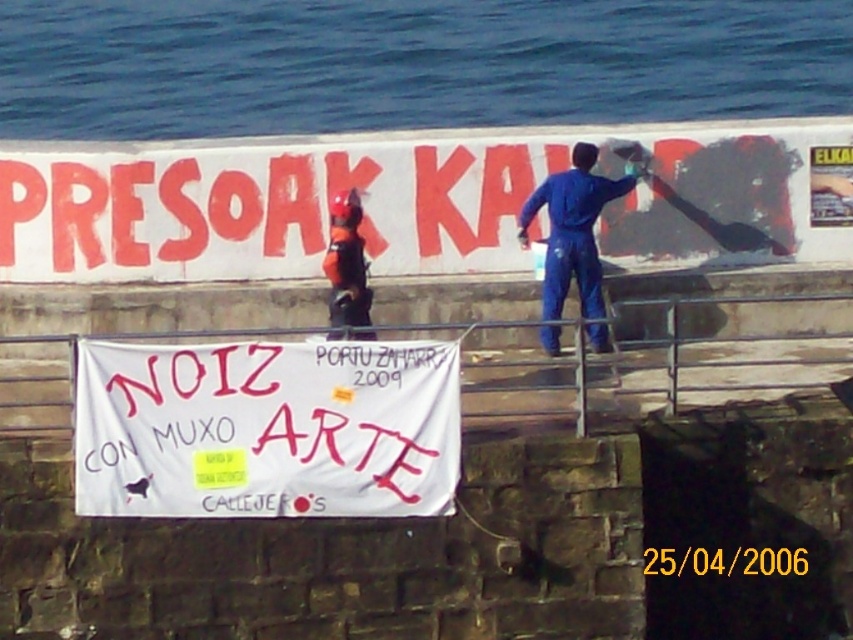
Question: Which of the following is the farthest from the observer?

Choices:
 (A) (65, 353)
 (B) (585, 300)
 (C) (421, 394)
 (D) (329, 289)

Answer: (A)

Question: Based on their relative distances, which object is nearer to the blue water at upper left?

Choices:
 (A) white paper banner at center
 (B) blue jumpsuit at upper center

Answer: (B)

Question: Which is farther from the blue jumpsuit at upper center?

Choices:
 (A) white paper banner at upper center
 (B) white paper banner at center

Answer: (B)

Question: Where is brushed metal rail at center located in relation to orange fabric helmet at center in the image?

Choices:
 (A) above
 (B) below

Answer: (B)

Question: Is brushed metal rail at center above orange fabric helmet at center?

Choices:
 (A) no
 (B) yes

Answer: (A)

Question: Does blue water at upper left appear on the left side of orange fabric helmet at center?

Choices:
 (A) no
 (B) yes

Answer: (A)